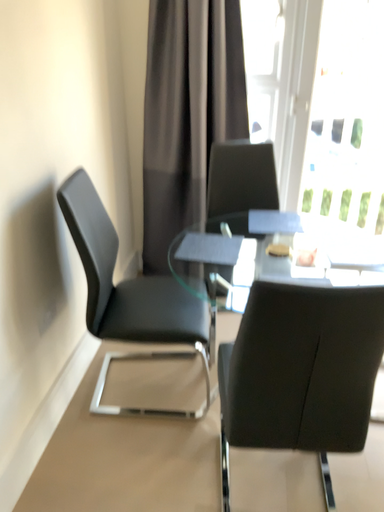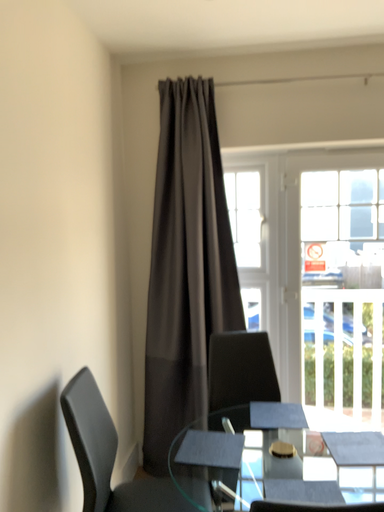
Question: Which way did the camera rotate in the video?

Choices:
 (A) rotated downward
 (B) rotated upward

Answer: (B)